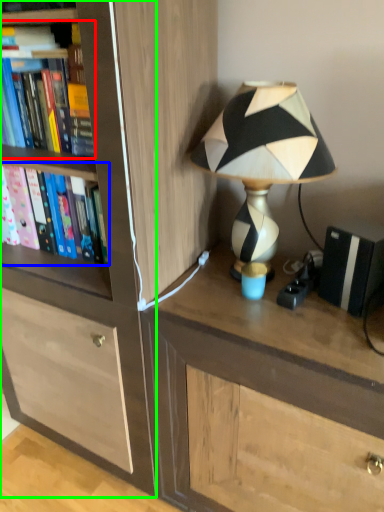
Question: Which is nearer to the book (highlighted by a red box)? book (highlighted by a blue box) or cabinetry (highlighted by a green box).

Choices:
 (A) book
 (B) cabinetry

Answer: (A)